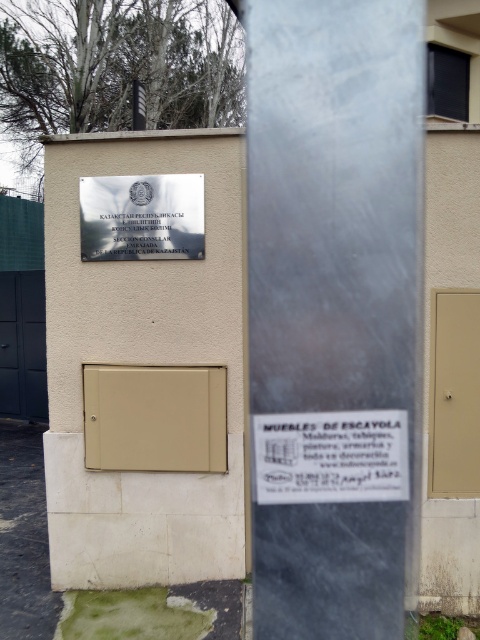
Does beige matte door at center have a greater width compared to white paper sign at center?

Yes, beige matte door at center is wider than white paper sign at center.

Does beige matte door at center lie behind white paper sign at center?

Yes, it is behind white paper sign at center.

I want to click on beige matte door at center, so click(155, 419).

Can you confirm if beige matte door at center is positioned below metallic silver sign at upper center?

Yes, beige matte door at center is below metallic silver sign at upper center.

Can you confirm if beige matte door at center is wider than metallic silver sign at upper center?

Indeed, beige matte door at center has a greater width compared to metallic silver sign at upper center.

Is point (189, 394) more distant than point (136, 236)?

No, (189, 394) is closer to viewer.

Find the location of a particular element. beige matte door at center is located at coordinates (155, 419).

Who is more forward, (290,484) or (84,253)?

Positioned in front is point (290,484).

Is white paper sign at center closer to camera compared to metallic silver sign at upper center?

Yes, white paper sign at center is in front of metallic silver sign at upper center.

Describe the element at coordinates (331, 456) in the screenshot. I see `white paper sign at center` at that location.

At what (x,y) coordinates should I click in order to perform the action: click on white paper sign at center. Please return your answer as a coordinate pair (x, y). This screenshot has height=640, width=480. Looking at the image, I should click on (331, 456).